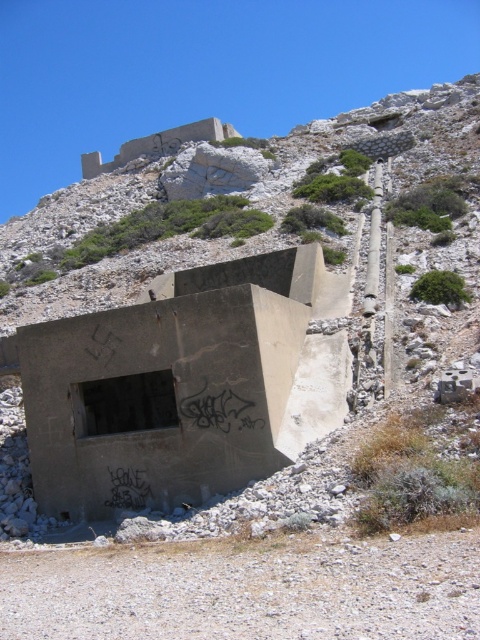
Question: Does concrete bunker at center appear on the right side of gray concrete bunker at lower center?

Choices:
 (A) no
 (B) yes

Answer: (A)

Question: Which object appears farthest from the camera in this image?

Choices:
 (A) gray concrete bunker at lower center
 (B) concrete bunker at center

Answer: (B)

Question: In this image, where is concrete bunker at center located relative to gray concrete bunker at lower center?

Choices:
 (A) right
 (B) left

Answer: (B)

Question: Observing the image, what is the correct spatial positioning of concrete bunker at center in reference to gray concrete bunker at lower center?

Choices:
 (A) left
 (B) right

Answer: (A)

Question: Among these points, which one is farthest from the camera?

Choices:
 (A) (314, 564)
 (B) (275, 196)

Answer: (B)

Question: Which point is closer to the camera taking this photo?

Choices:
 (A) (254, 541)
 (B) (37, 317)

Answer: (A)